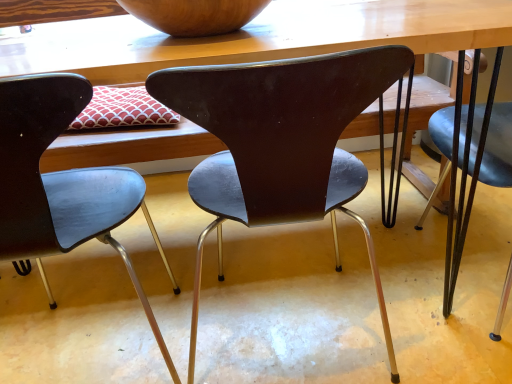
Question: In which direction should I rotate to look at matte black chair at center, positioned as the first chair in right-to-left order?

Choices:
 (A) right
 (B) left

Answer: (A)

Question: Is matte black chair at center, the 2th chair positioned from the right, in contact with wooden table at center?

Choices:
 (A) no
 (B) yes

Answer: (A)

Question: From a real-world perspective, is matte black chair at center, the 2th chair positioned from the right, on wooden table at center?

Choices:
 (A) yes
 (B) no

Answer: (A)

Question: Is matte black chair at center, the 2th chair positioned from the right, thinner than wooden table at center?

Choices:
 (A) no
 (B) yes

Answer: (B)

Question: Is matte black chair at center, which is the 1th chair from left to right, oriented away from wooden table at center?

Choices:
 (A) no
 (B) yes

Answer: (B)

Question: Does matte black chair at center, which is the 1th chair from left to right, appear on the left side of wooden table at center?

Choices:
 (A) no
 (B) yes

Answer: (B)

Question: From the image's perspective, is matte black chair at center, the 2th chair positioned from the right, beneath wooden table at center?

Choices:
 (A) yes
 (B) no

Answer: (A)

Question: Does wooden table at center turn towards matte black chair at center, the 2th chair positioned from the right?

Choices:
 (A) no
 (B) yes

Answer: (B)

Question: Considering the relative sizes of wooden table at center and matte black chair at center, the 2th chair positioned from the right, in the image provided, is wooden table at center bigger than matte black chair at center, the 2th chair positioned from the right,?

Choices:
 (A) yes
 (B) no

Answer: (A)

Question: Is wooden table at center outside matte black chair at center, which is the 1th chair from left to right?

Choices:
 (A) no
 (B) yes

Answer: (B)

Question: Are wooden table at center and matte black chair at center, the 2th chair positioned from the right, beside each other?

Choices:
 (A) yes
 (B) no

Answer: (B)

Question: Does wooden table at center have a lesser height compared to matte black chair at center, the 2th chair positioned from the right?

Choices:
 (A) yes
 (B) no

Answer: (B)

Question: Does wooden table at center have a lesser width compared to matte black chair at center, which is the 1th chair from left to right?

Choices:
 (A) no
 (B) yes

Answer: (A)

Question: Can you confirm if matte black chair at center, which is the 1th chair from left to right, is wider than wooden bowl at upper center?

Choices:
 (A) yes
 (B) no

Answer: (A)